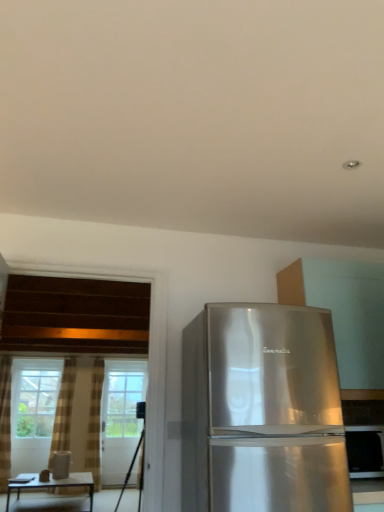
Question: From a real-world perspective, is satin silver refrigerator at right above or below matte brown table at lower left?

Choices:
 (A) above
 (B) below

Answer: (A)

Question: Relative to matte brown table at lower left, is satin silver refrigerator at right in front or behind?

Choices:
 (A) behind
 (B) front

Answer: (B)

Question: Estimate the real-world distances between objects in this image. Which object is closer to the brown textured curtain at left, which is counted as the first curtain, starting from the left?

Choices:
 (A) clear glass window at left
 (B) satin silver refrigerator at right
 (C) matte brown table at lower left
 (D) black matte tripod at lower left
 (E) plaid fabric curtain at left, acting as the 2th curtain starting from the left

Answer: (A)

Question: Which object is positioned farthest from the satin silver refrigerator at right?

Choices:
 (A) brown textured curtain at left, marked as the 2th curtain in a right-to-left arrangement
 (B) satin silver refrigerator at right
 (C) black matte tripod at lower left
 (D) clear glass screen door at center
 (E) matte brown table at lower left

Answer: (E)